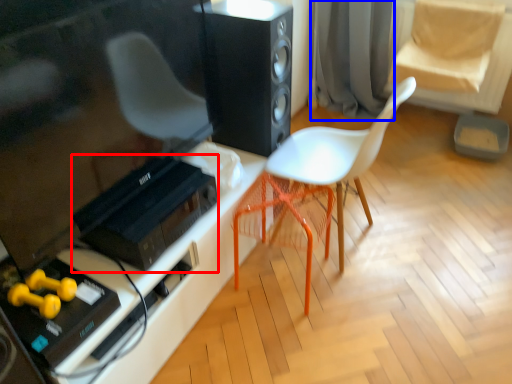
Question: Among these objects, which one is nearest to the camera, stereo (highlighted by a red box) or curtain (highlighted by a blue box)?

Choices:
 (A) stereo
 (B) curtain

Answer: (A)